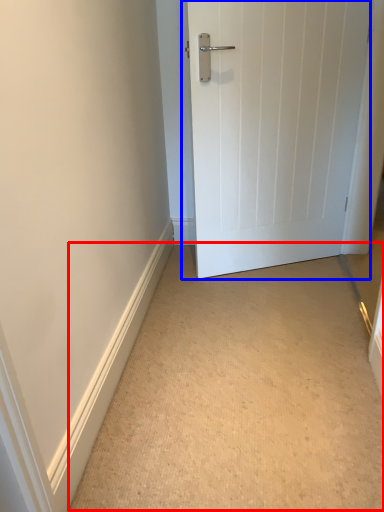
Question: Among these objects, which one is nearest to the camera, corridor (highlighted by a red box) or door (highlighted by a blue box)?

Choices:
 (A) corridor
 (B) door

Answer: (A)